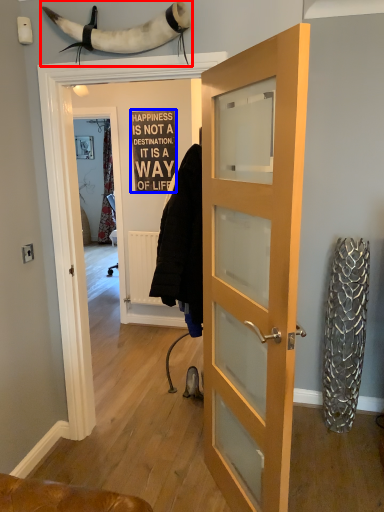
Question: Which object is further to the camera taking this photo, animal (highlighted by a red box) or writing (highlighted by a blue box)?

Choices:
 (A) animal
 (B) writing

Answer: (B)